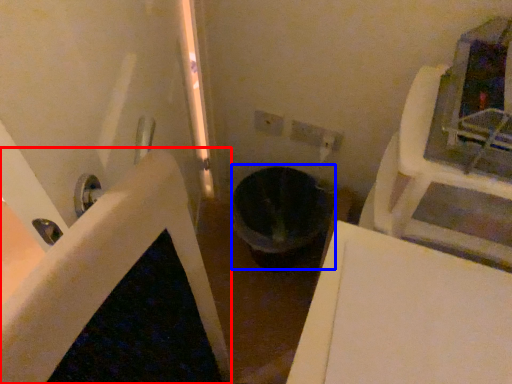
Question: Which object is further to the camera taking this photo, bath (highlighted by a red box) or toilet bowl (highlighted by a blue box)?

Choices:
 (A) bath
 (B) toilet bowl

Answer: (B)